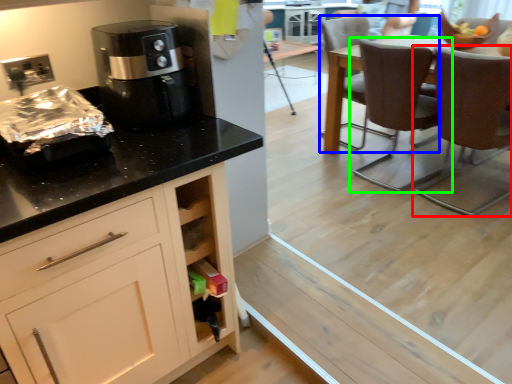
Question: Estimate the real-world distances between objects in this image. Which object is closer to chair (highlighted by a red box), chair (highlighted by a blue box) or chair (highlighted by a green box)?

Choices:
 (A) chair
 (B) chair

Answer: (B)